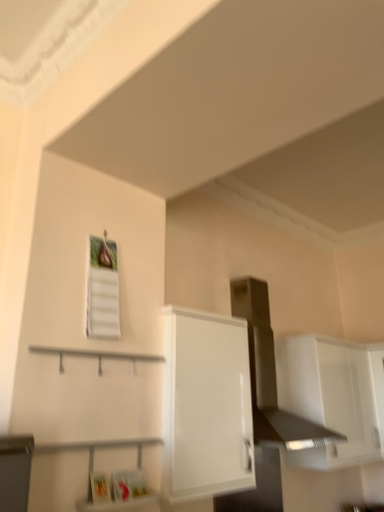
This screenshot has height=512, width=384. What do you see at coordinates (333, 397) in the screenshot? I see `white glossy cabinet at upper right, the first cabinetry when ordered from right to left` at bounding box center [333, 397].

Image resolution: width=384 pixels, height=512 pixels. Identify the location of satin silver vent at upper center. pyautogui.click(x=270, y=373).

The image size is (384, 512). What are the coordinates of `vent that appears above the white glossy cabinet at center, which appears as the 1th cabinetry when viewed from the front (from a real-world perspective)` in the screenshot? It's located at (270, 373).

Is white glossy cabinet at center, the 2th cabinetry when ordered from back to front, not close to satin silver vent at upper center?

white glossy cabinet at center, the 2th cabinetry when ordered from back to front, is near satin silver vent at upper center, not far away.

Which of these two, white glossy cabinet at center, which appears as the 1th cabinetry when viewed from the front, or satin silver vent at upper center, stands shorter?

white glossy cabinet at center, which appears as the 1th cabinetry when viewed from the front.

From a real-world perspective, relative to satin silver vent at upper center, is white glossy cabinet at center, the 2th cabinetry when ordered from back to front, vertically above or below?

From a real-world perspective, white glossy cabinet at center, the 2th cabinetry when ordered from back to front, is physically below satin silver vent at upper center.

Can we say satin silver vent at upper center lies outside white glossy cabinet at upper right, marked as the 2th cabinetry in a front-to-back arrangement?

satin silver vent at upper center lies outside white glossy cabinet at upper right, marked as the 2th cabinetry in a front-to-back arrangement,'s area.

Which is behind, point (241, 288) or point (281, 399)?

Point (281, 399)

Based on the photo, between satin silver vent at upper center and white glossy cabinet at upper right, marked as the 2th cabinetry in a front-to-back arrangement, which one has larger width?

Wider between the two is satin silver vent at upper center.

Which of these two, satin silver vent at upper center or white glossy cabinet at upper right, the second cabinetry when ordered from left to right, is smaller?

white glossy cabinet at upper right, the second cabinetry when ordered from left to right, is smaller.

Who is bigger, white glossy cabinet at center, which appears as the 1th cabinetry when viewed from the front, or white glossy cabinet at upper right, the first cabinetry when ordered from right to left?

With larger size is white glossy cabinet at upper right, the first cabinetry when ordered from right to left.

Which is more to the left, white glossy cabinet at center, the 2th cabinetry when ordered from back to front, or white glossy cabinet at upper right, the 1th cabinetry from the back?

white glossy cabinet at center, the 2th cabinetry when ordered from back to front.

The height and width of the screenshot is (512, 384). Identify the location of cabinetry above the white glossy cabinet at upper right, the 1th cabinetry from the back (from the image's perspective). (206, 406).

Does satin silver vent at upper center have a larger size compared to white glossy cabinet at center, the 2th cabinetry in the right-to-left sequence?

Indeed, satin silver vent at upper center has a larger size compared to white glossy cabinet at center, the 2th cabinetry in the right-to-left sequence.

Is point (298, 434) closer or farther from the camera than point (204, 351)?

Point (298, 434).

Who is shorter, satin silver vent at upper center or white glossy cabinet at center, which appears as the 1th cabinetry when viewed from the front?

→ Standing shorter between the two is white glossy cabinet at center, which appears as the 1th cabinetry when viewed from the front.

Is point (351, 372) closer to camera compared to point (258, 381)?

No, it is behind (258, 381).

Could you tell me if white glossy cabinet at upper right, the 1th cabinetry from the back, is facing satin silver vent at upper center?

No.

In terms of size, does white glossy cabinet at upper right, the first cabinetry when ordered from right to left, appear bigger or smaller than satin silver vent at upper center?

In the image, white glossy cabinet at upper right, the first cabinetry when ordered from right to left, appears to be smaller than satin silver vent at upper center.

From the image's perspective, which is below, white glossy cabinet at upper right, the 1th cabinetry from the back, or satin silver vent at upper center?

white glossy cabinet at upper right, the 1th cabinetry from the back, is shown below in the image.

Considering the points (283, 402) and (194, 352), which point is behind, point (283, 402) or point (194, 352)?

The point (283, 402) is more distant.

Does white glossy cabinet at upper right, marked as the 2th cabinetry in a front-to-back arrangement, come behind white glossy cabinet at center, the 2th cabinetry in the right-to-left sequence?

That is True.

From a real-world perspective, is white glossy cabinet at upper right, marked as the 2th cabinetry in a front-to-back arrangement, physically above white glossy cabinet at center, the 2th cabinetry in the right-to-left sequence?

Yes, from a real-world perspective, white glossy cabinet at upper right, marked as the 2th cabinetry in a front-to-back arrangement, is above white glossy cabinet at center, the 2th cabinetry in the right-to-left sequence.

Identify the location of vent on the right side of white glossy cabinet at center, which appears as the 1th cabinetry when viewed from the front. The width and height of the screenshot is (384, 512). (270, 373).

Identify the location of the 1st cabinetry directly beneath the satin silver vent at upper center (from a real-world perspective). Image resolution: width=384 pixels, height=512 pixels. (333, 397).

Considering their positions, is white glossy cabinet at upper right, the 1th cabinetry from the back, positioned closer to white glossy cabinet at center, marked as the 1th cabinetry in a left-to-right arrangement, than satin silver vent at upper center?

satin silver vent at upper center.

When comparing their distances from white glossy cabinet at upper right, the first cabinetry when ordered from right to left, does white glossy cabinet at center, which appears as the 1th cabinetry when viewed from the front, or satin silver vent at upper center seem further?

white glossy cabinet at center, which appears as the 1th cabinetry when viewed from the front, is further to white glossy cabinet at upper right, the first cabinetry when ordered from right to left.

From the image, which object appears to be nearer to satin silver vent at upper center, white glossy cabinet at upper right, the second cabinetry when ordered from left to right, or white glossy cabinet at center, the 2th cabinetry when ordered from back to front?

Among the two, white glossy cabinet at upper right, the second cabinetry when ordered from left to right, is located nearer to satin silver vent at upper center.

Estimate the real-world distances between objects in this image. Which object is closer to white glossy cabinet at upper right, the 1th cabinetry from the back, satin silver vent at upper center or white glossy cabinet at center, the 2th cabinetry when ordered from back to front?

The object closer to white glossy cabinet at upper right, the 1th cabinetry from the back, is satin silver vent at upper center.

Estimate the real-world distances between objects in this image. Which object is further from white glossy cabinet at center, the 2th cabinetry in the right-to-left sequence, satin silver vent at upper center or white glossy cabinet at upper right, the first cabinetry when ordered from right to left?

white glossy cabinet at upper right, the first cabinetry when ordered from right to left, lies further to white glossy cabinet at center, the 2th cabinetry in the right-to-left sequence, than the other object.

Estimate the real-world distances between objects in this image. Which object is closer to satin silver vent at upper center, white glossy cabinet at center, which appears as the 1th cabinetry when viewed from the front, or white glossy cabinet at upper right, marked as the 2th cabinetry in a front-to-back arrangement?

Based on the image, white glossy cabinet at upper right, marked as the 2th cabinetry in a front-to-back arrangement, appears to be nearer to satin silver vent at upper center.

Image resolution: width=384 pixels, height=512 pixels. What are the coordinates of `vent located between white glossy cabinet at center, marked as the 1th cabinetry in a left-to-right arrangement, and white glossy cabinet at upper right, the second cabinetry when ordered from left to right, in the left-right direction` in the screenshot? It's located at (270, 373).